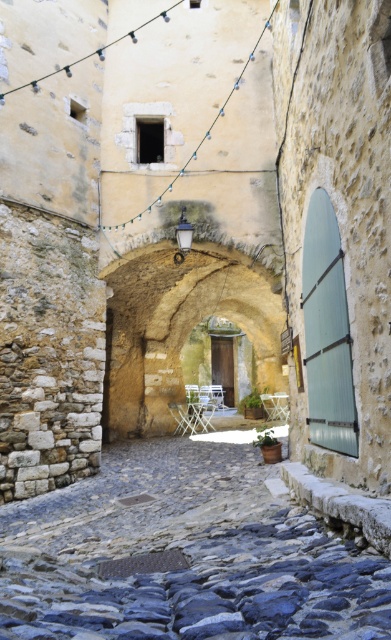
You are a delivery person carrying a package and need to navigate through the alley. You see the smooth cobblestone alley at center and the white plastic chair at center. Which object is positioned to the left of the other?

The smooth cobblestone alley at center is to the left of the white plastic chair at center.

You are a delivery person carrying a large package and need to navigate through the alley. The package is too heavy to lift. You see the smooth cobblestone alley at center and the white plastic chair at center. Which object must you avoid stepping on to keep the package from slipping?

The smooth cobblestone alley at center is located above the white plastic chair at center. Since the smooth cobblestone alley at center is the surface you walk on, you should avoid stepping on the white plastic chair at center to prevent the package from slipping off the higher ground.